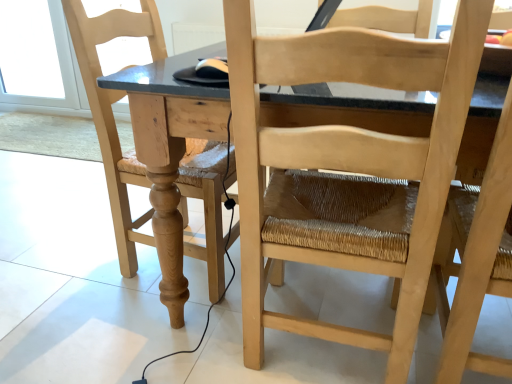
Question: Based on their positions, is natural wood table at center located to the left or right of natural wood chair at center, placed as the second chair when sorted from left to right?

Choices:
 (A) right
 (B) left

Answer: (A)

Question: Considering the positions of natural wood table at center and natural wood chair at center, the 2th chair positioned from the right, in the image, is natural wood table at center taller or shorter than natural wood chair at center, the 2th chair positioned from the right,?

Choices:
 (A) short
 (B) tall

Answer: (A)

Question: Based on their relative distances, which object is nearer to the natural wood table at center?

Choices:
 (A) natural wood chair at center, placed as the second chair when sorted from left to right
 (B) transparent glass door at upper left
 (C) natural wood chair at right, which is the 1th chair in right-to-left order
 (D) natural wood chair at left, the third chair positioned from the right

Answer: (A)

Question: Which is nearer to the natural wood chair at center, the 2th chair positioned from the right?

Choices:
 (A) natural wood chair at right, which is the 1th chair in right-to-left order
 (B) natural wood table at center
 (C) transparent glass door at upper left
 (D) natural wood chair at left, the first chair in the left-to-right sequence

Answer: (B)